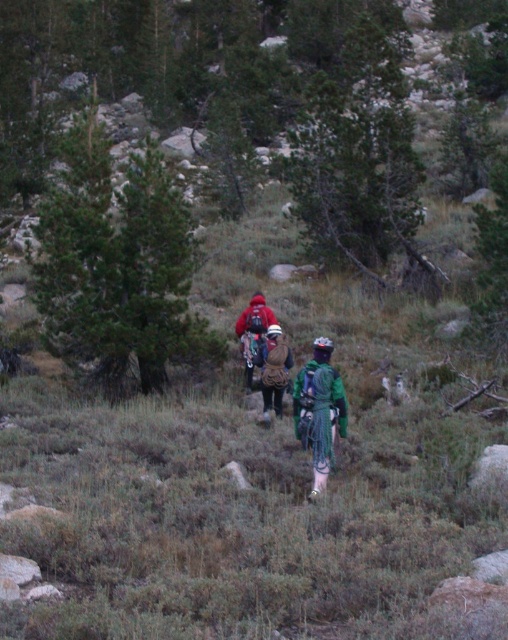
Is green fabric backpack at center closer to camera compared to brown fuzzy jacket at center?

Yes, green fabric backpack at center is in front of brown fuzzy jacket at center.

Is green fabric backpack at center bigger than brown fuzzy jacket at center?

Yes.

Between point (318, 340) and point (282, 339), which one is positioned in front?

Point (318, 340)

This screenshot has width=508, height=640. I want to click on green fabric backpack at center, so pyautogui.click(x=320, y=410).

Does brown fuzzy jacket at center have a larger size compared to matte red jacket at center?

Actually, brown fuzzy jacket at center might be smaller than matte red jacket at center.

Who is more forward, [285,362] or [250,308]?

Point [285,362] is more forward.

The width and height of the screenshot is (508, 640). I want to click on brown fuzzy jacket at center, so click(x=273, y=369).

Is green fabric backpack at center above matte red jacket at center?

No.

Between green fabric backpack at center and matte red jacket at center, which one has more height?

green fabric backpack at center is taller.

At what (x,y) coordinates should I click in order to perform the action: click on green fabric backpack at center. Please return your answer as a coordinate pair (x, y). Looking at the image, I should click on coord(320,410).